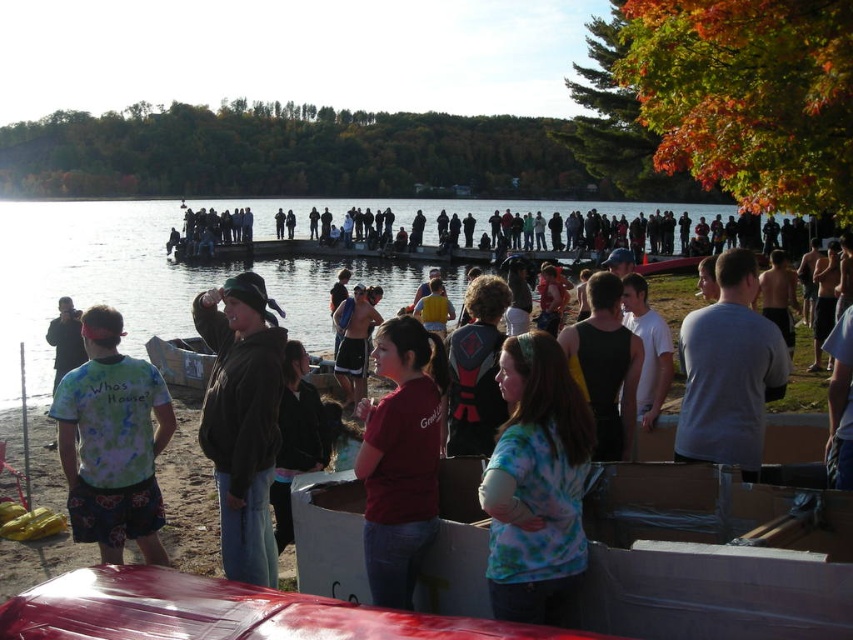
You are standing at the edge of the lake and see the point marked as point (x=476, y=371). What object is located at this point?

The matte black backpack at center is located at point (x=476, y=371).

You are organizing a group photo and need to ensure that the matte black backpack at center and the dark gray hoodie at center are both visible in the frame. Considering their sizes, which object should be placed closer to the camera to maintain visibility without overlapping?

The matte black backpack at center is wider than the dark gray hoodie at center. To ensure both are visible without overlapping, the dark gray hoodie at center should be placed closer to the camera since it is narrower and requires less space in the frame.